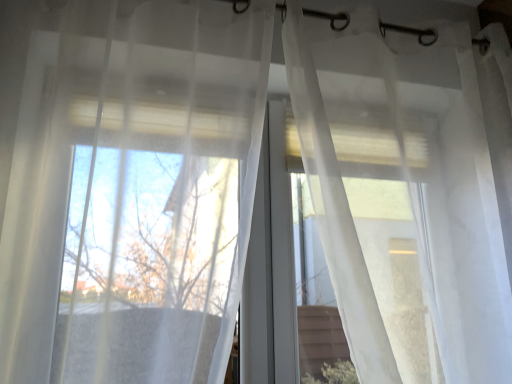
I want to click on translucent white curtain at center, which ranks as the 2th curtain in right-to-left order, so click(162, 193).

Measure the distance between point (182, 158) and camera.

The distance of point (182, 158) from camera is 1.02 meters.

What is the approximate height of translucent white curtain at center, which ranks as the 2th curtain in right-to-left order?

It is 1.07 meters.

The width and height of the screenshot is (512, 384). What do you see at coordinates (162, 193) in the screenshot? I see `translucent white curtain at center, the 1th curtain from the left` at bounding box center [162, 193].

The width and height of the screenshot is (512, 384). What do you see at coordinates (406, 194) in the screenshot?
I see `translucent white curtain at center, the first curtain in the right-to-left sequence` at bounding box center [406, 194].

The image size is (512, 384). In order to click on translucent white curtain at center, the first curtain in the right-to-left sequence in this screenshot , I will do `click(406, 194)`.

Identify the location of translucent white curtain at center, the 1th curtain from the left. Image resolution: width=512 pixels, height=384 pixels. (162, 193).

Is translucent white curtain at center, which ranks as the 2th curtain in left-to-right order, to the left of translucent white curtain at center, the 1th curtain from the left, from the viewer's perspective?

Incorrect, translucent white curtain at center, which ranks as the 2th curtain in left-to-right order, is not on the left side of translucent white curtain at center, the 1th curtain from the left.

In the image, is translucent white curtain at center, the first curtain in the right-to-left sequence, positioned in front of or behind translucent white curtain at center, which ranks as the 2th curtain in right-to-left order?

translucent white curtain at center, the first curtain in the right-to-left sequence, is positioned farther from the viewer than translucent white curtain at center, which ranks as the 2th curtain in right-to-left order.

Which is nearer, (357, 50) or (135, 366)?

Clearly, point (357, 50) is more distant from the camera than point (135, 366).

From the image's perspective, does translucent white curtain at center, the first curtain in the right-to-left sequence, appear higher than translucent white curtain at center, the 1th curtain from the left?

No, from the image's perspective, translucent white curtain at center, the first curtain in the right-to-left sequence, is not over translucent white curtain at center, the 1th curtain from the left.

From a real-world perspective, is translucent white curtain at center, the first curtain in the right-to-left sequence, on top of translucent white curtain at center, the 1th curtain from the left?

Actually, translucent white curtain at center, the first curtain in the right-to-left sequence, is physically below translucent white curtain at center, the 1th curtain from the left, in the real world.

Considering the sizes of objects translucent white curtain at center, which ranks as the 2th curtain in left-to-right order, and translucent white curtain at center, which ranks as the 2th curtain in right-to-left order, in the image provided, who is thinner, translucent white curtain at center, which ranks as the 2th curtain in left-to-right order, or translucent white curtain at center, which ranks as the 2th curtain in right-to-left order,?

translucent white curtain at center, which ranks as the 2th curtain in left-to-right order.

Considering the relative sizes of translucent white curtain at center, the first curtain in the right-to-left sequence, and translucent white curtain at center, which ranks as the 2th curtain in right-to-left order, in the image provided, is translucent white curtain at center, the first curtain in the right-to-left sequence, taller than translucent white curtain at center, which ranks as the 2th curtain in right-to-left order,?

Correct, translucent white curtain at center, the first curtain in the right-to-left sequence, is much taller as translucent white curtain at center, which ranks as the 2th curtain in right-to-left order.

Consider the image. Who is bigger, translucent white curtain at center, the first curtain in the right-to-left sequence, or translucent white curtain at center, which ranks as the 2th curtain in right-to-left order?

translucent white curtain at center, the first curtain in the right-to-left sequence.

Is translucent white curtain at center, the 1th curtain from the left, completely or partially inside translucent white curtain at center, which ranks as the 2th curtain in left-to-right order?

No.

Is there a large distance between translucent white curtain at center, which ranks as the 2th curtain in left-to-right order, and translucent white curtain at center, which ranks as the 2th curtain in right-to-left order?

That's not correct — translucent white curtain at center, which ranks as the 2th curtain in left-to-right order, is a little close to translucent white curtain at center, which ranks as the 2th curtain in right-to-left order.

Is translucent white curtain at center, the first curtain in the right-to-left sequence, facing away from translucent white curtain at center, the 1th curtain from the left?

No.

What's the angular difference between translucent white curtain at center, the first curtain in the right-to-left sequence, and translucent white curtain at center, the 1th curtain from the left,'s facing directions?

The angular difference between translucent white curtain at center, the first curtain in the right-to-left sequence, and translucent white curtain at center, the 1th curtain from the left, is 0.000225 degrees.

Locate an element on the screen. This screenshot has height=384, width=512. curtain above the translucent white curtain at center, which ranks as the 2th curtain in left-to-right order (from a real-world perspective) is located at coordinates (162, 193).

Is translucent white curtain at center, the 1th curtain from the left, to the left or to the right of translucent white curtain at center, the first curtain in the right-to-left sequence, in the image?

Based on their positions, translucent white curtain at center, the 1th curtain from the left, is located to the left of translucent white curtain at center, the first curtain in the right-to-left sequence.

Which object is further away from the camera, translucent white curtain at center, the 1th curtain from the left, or translucent white curtain at center, the first curtain in the right-to-left sequence?

translucent white curtain at center, the first curtain in the right-to-left sequence.

Is point (213, 128) closer or farther from the camera than point (446, 367)?

Clearly, point (213, 128) is more distant from the camera than point (446, 367).

From the image's perspective, which one is positioned higher, translucent white curtain at center, the 1th curtain from the left, or translucent white curtain at center, which ranks as the 2th curtain in left-to-right order?

translucent white curtain at center, the 1th curtain from the left.

From a real-world perspective, is translucent white curtain at center, which ranks as the 2th curtain in right-to-left order, positioned above or below translucent white curtain at center, which ranks as the 2th curtain in left-to-right order?

In terms of real-world spatial position, translucent white curtain at center, which ranks as the 2th curtain in right-to-left order, is above translucent white curtain at center, which ranks as the 2th curtain in left-to-right order.

Between translucent white curtain at center, which ranks as the 2th curtain in right-to-left order, and translucent white curtain at center, the first curtain in the right-to-left sequence, which one has smaller width?

With smaller width is translucent white curtain at center, the first curtain in the right-to-left sequence.

Is translucent white curtain at center, which ranks as the 2th curtain in right-to-left order, taller or shorter than translucent white curtain at center, which ranks as the 2th curtain in left-to-right order?

Clearly, translucent white curtain at center, which ranks as the 2th curtain in right-to-left order, is shorter compared to translucent white curtain at center, which ranks as the 2th curtain in left-to-right order.

Who is bigger, translucent white curtain at center, which ranks as the 2th curtain in right-to-left order, or translucent white curtain at center, which ranks as the 2th curtain in left-to-right order?

translucent white curtain at center, which ranks as the 2th curtain in left-to-right order.

From the picture: Is translucent white curtain at center, which ranks as the 2th curtain in left-to-right order, surrounded by translucent white curtain at center, which ranks as the 2th curtain in right-to-left order?

That's incorrect, translucent white curtain at center, which ranks as the 2th curtain in left-to-right order, is not inside translucent white curtain at center, which ranks as the 2th curtain in right-to-left order.

Is translucent white curtain at center, the 1th curtain from the left, far away from translucent white curtain at center, the first curtain in the right-to-left sequence?

Actually, translucent white curtain at center, the 1th curtain from the left, and translucent white curtain at center, the first curtain in the right-to-left sequence, are a little close together.

Does translucent white curtain at center, which ranks as the 2th curtain in right-to-left order, turn towards translucent white curtain at center, which ranks as the 2th curtain in left-to-right order?

No, translucent white curtain at center, which ranks as the 2th curtain in right-to-left order, does not turn towards translucent white curtain at center, which ranks as the 2th curtain in left-to-right order.

Could you measure the distance between translucent white curtain at center, the 1th curtain from the left, and translucent white curtain at center, the first curtain in the right-to-left sequence?

The distance of translucent white curtain at center, the 1th curtain from the left, from translucent white curtain at center, the first curtain in the right-to-left sequence, is 40.10 centimeters.

Image resolution: width=512 pixels, height=384 pixels. What are the coordinates of `curtain on the right of translucent white curtain at center, the 1th curtain from the left` in the screenshot? It's located at (406, 194).

Locate an element on the screen. curtain above the translucent white curtain at center, the first curtain in the right-to-left sequence (from the image's perspective) is located at coordinates (162, 193).

The width and height of the screenshot is (512, 384). Find the location of `curtain below the translucent white curtain at center, the 1th curtain from the left (from a real-world perspective)`. curtain below the translucent white curtain at center, the 1th curtain from the left (from a real-world perspective) is located at coordinates (406, 194).